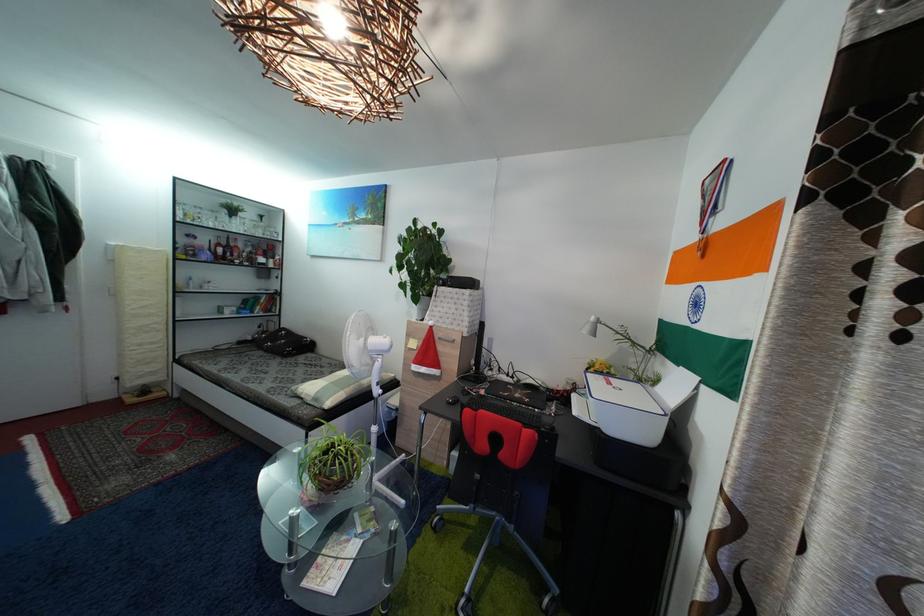
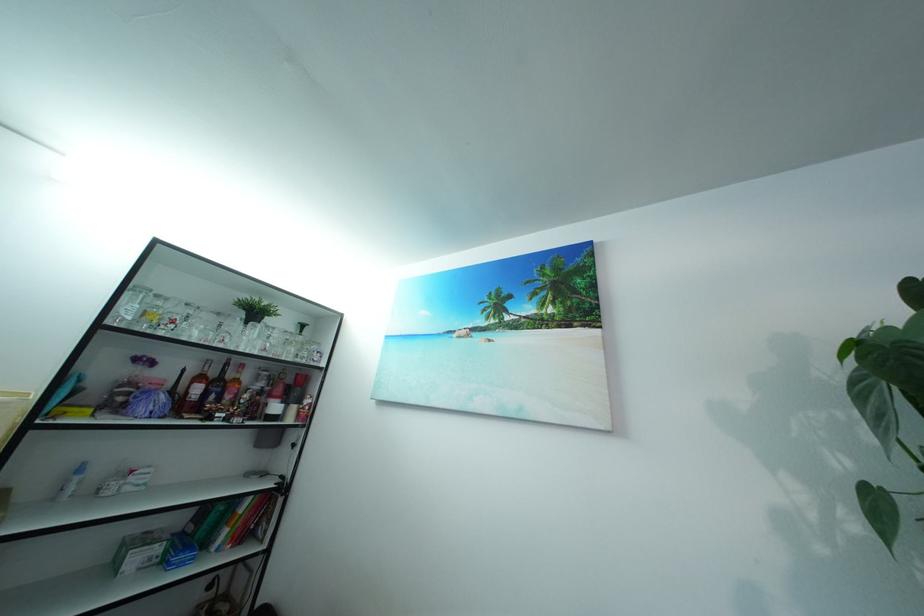
The images are taken continuously from a first-person perspective. In which direction are you moving?

The movement direction of the cameraman is left, forward.